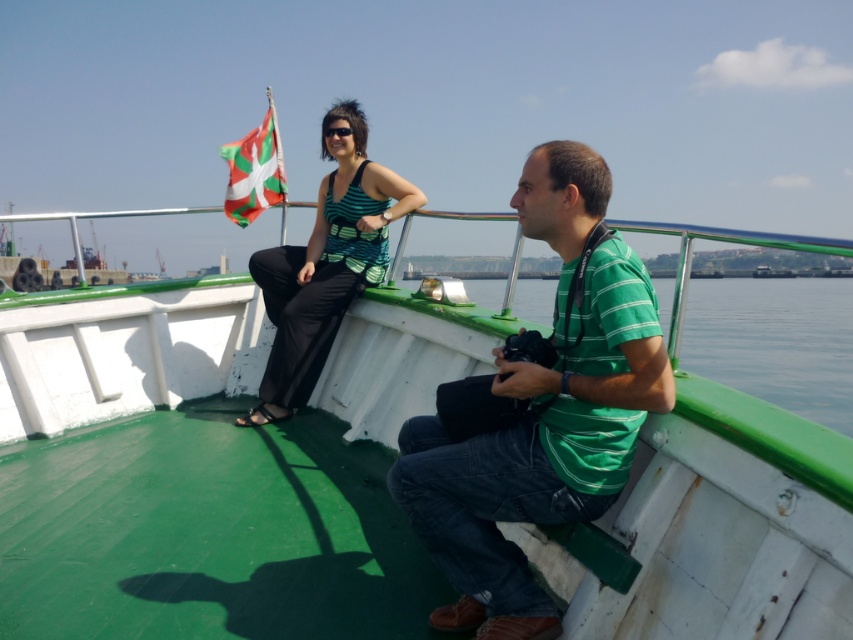
Question: Is green striped shirt at center further to the viewer compared to matte green tank top at upper center?

Choices:
 (A) no
 (B) yes

Answer: (A)

Question: Is the position of green matte boat at center more distant than that of white and green fabric flag at upper left?

Choices:
 (A) yes
 (B) no

Answer: (B)

Question: Considering the real-world distances, which object is farthest from the green matte boat at center?

Choices:
 (A) matte green tank top at upper center
 (B) white and green fabric flag at upper left
 (C) green striped shirt at center

Answer: (C)

Question: Which object is closer to the camera taking this photo?

Choices:
 (A) white and green fabric flag at upper left
 (B) green striped shirt at center
 (C) matte green tank top at upper center

Answer: (B)

Question: Does matte green tank top at upper center appear on the right side of white and green fabric flag at upper left?

Choices:
 (A) no
 (B) yes

Answer: (B)

Question: Which is nearer to the green matte boat at center?

Choices:
 (A) green striped shirt at center
 (B) matte green tank top at upper center

Answer: (B)